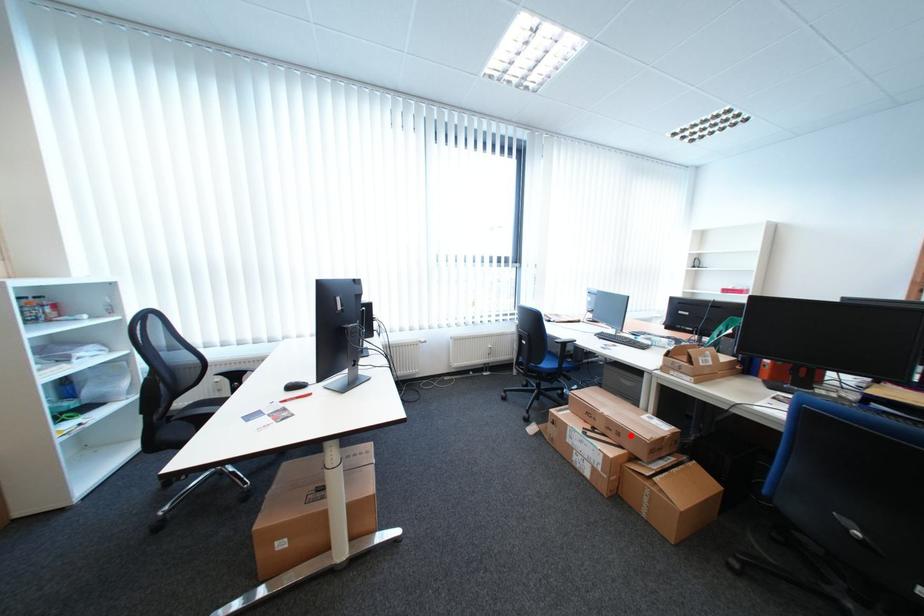
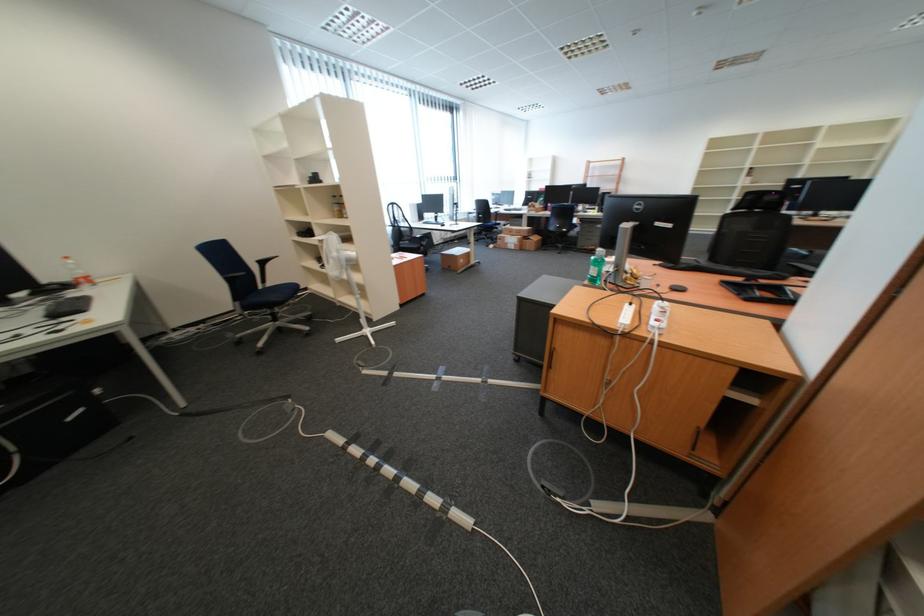
Question: I am providing you with two images of the same scene from different viewpoints. A red point is shown in image1. For the corresponding object point in image2, is it positioned nearer or farther from the camera?

Choices:
 (A) Nearer
 (B) Farther

Answer: (A)